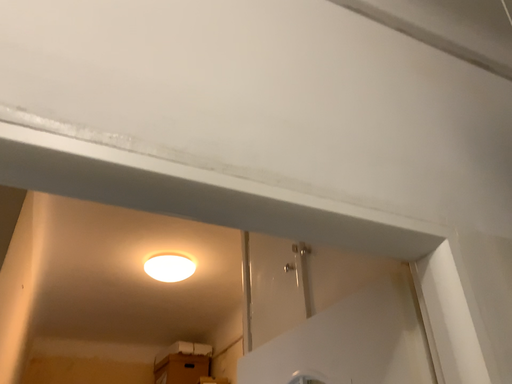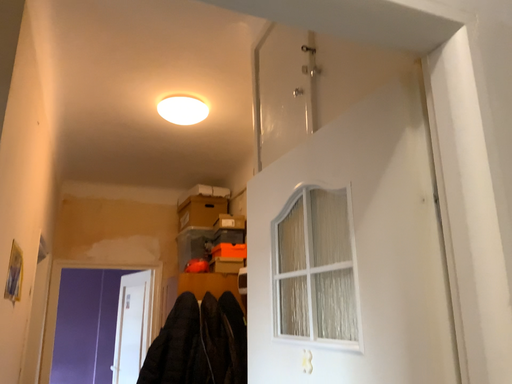
Question: Which way did the camera rotate in the video?

Choices:
 (A) rotated upward
 (B) rotated downward

Answer: (B)